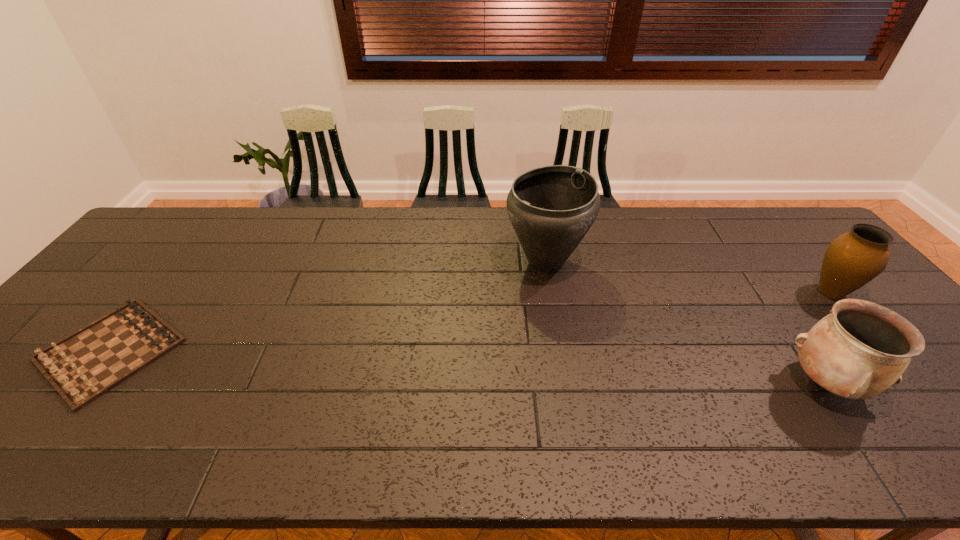
The height and width of the screenshot is (540, 960). In the image, there is a desktop. In order to click on vacant space at the far edge in this screenshot , I will do `click(421, 237)`.

Locate an element on the screen. vacant space at the near edge of the desktop is located at coordinates (655, 433).

The width and height of the screenshot is (960, 540). I want to click on free space at the left edge, so click(171, 261).

In the image, there is a desktop. In order to click on vacant space at the far left corner in this screenshot , I will do `click(165, 233)`.

Identify the location of vacant area that lies between the second object from right to left and the leftmost urn. (685, 323).

Where is `unoccupied position between the third object from left to right and the second object from left to right`? The height and width of the screenshot is (540, 960). unoccupied position between the third object from left to right and the second object from left to right is located at coordinates (685, 323).

Choose which object is the nearest neighbor to the second urn from right to left. Please provide its 2D coordinates. Your answer should be formatted as a tuple, i.e. [(x, y)], where the tuple contains the x and y coordinates of a point satisfying the conditions above.

[(853, 259)]

The height and width of the screenshot is (540, 960). In order to click on the closest object to the rightmost object in this screenshot , I will do `click(859, 350)`.

Locate an element on the screen. The image size is (960, 540). urn that stands as the closest to the second object from left to right is located at coordinates (859, 350).

Identify which urn is the second nearest to the rightmost object. Please provide its 2D coordinates. Your answer should be formatted as a tuple, i.e. [(x, y)], where the tuple contains the x and y coordinates of a point satisfying the conditions above.

[(551, 208)]